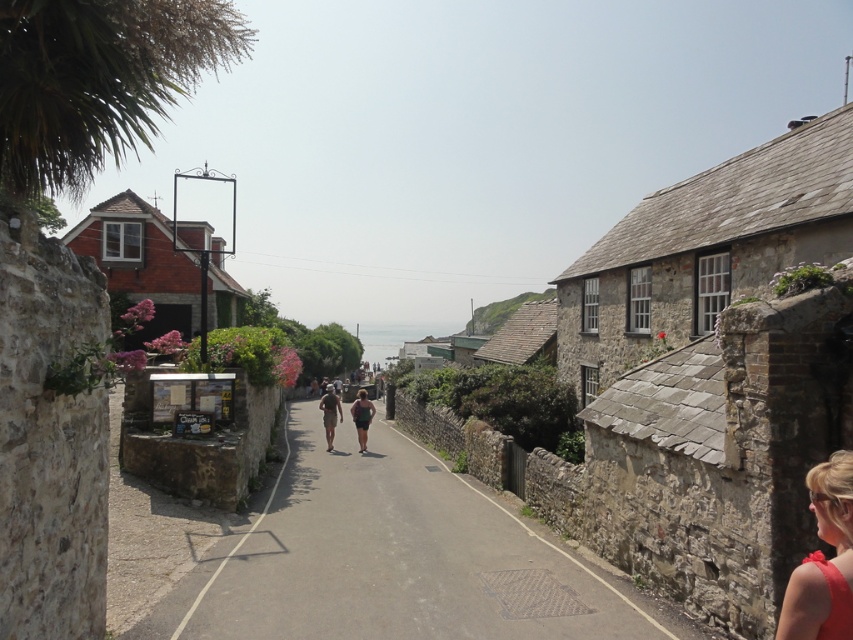
Question: Among these objects, which one is nearest to the camera?

Choices:
 (A) matte red dress at lower right
 (B) stone paved alley at center

Answer: (A)

Question: Among these points, which one is farthest from the camera?

Choices:
 (A) (531, 548)
 (B) (850, 490)

Answer: (A)

Question: Is stone paved alley at center in front of matte red dress at lower right?

Choices:
 (A) no
 (B) yes

Answer: (A)

Question: Does stone paved alley at center appear on the right side of matte red dress at lower right?

Choices:
 (A) yes
 (B) no

Answer: (B)

Question: In this image, where is stone paved alley at center located relative to matte red dress at lower right?

Choices:
 (A) below
 (B) above

Answer: (A)

Question: Among these points, which one is nearest to the camera?

Choices:
 (A) (534, 545)
 (B) (827, 525)

Answer: (B)